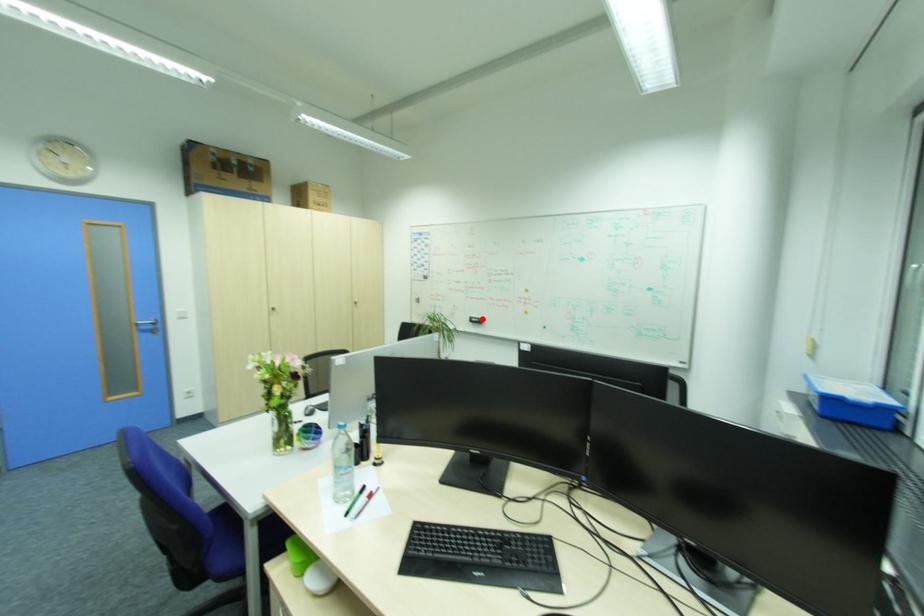
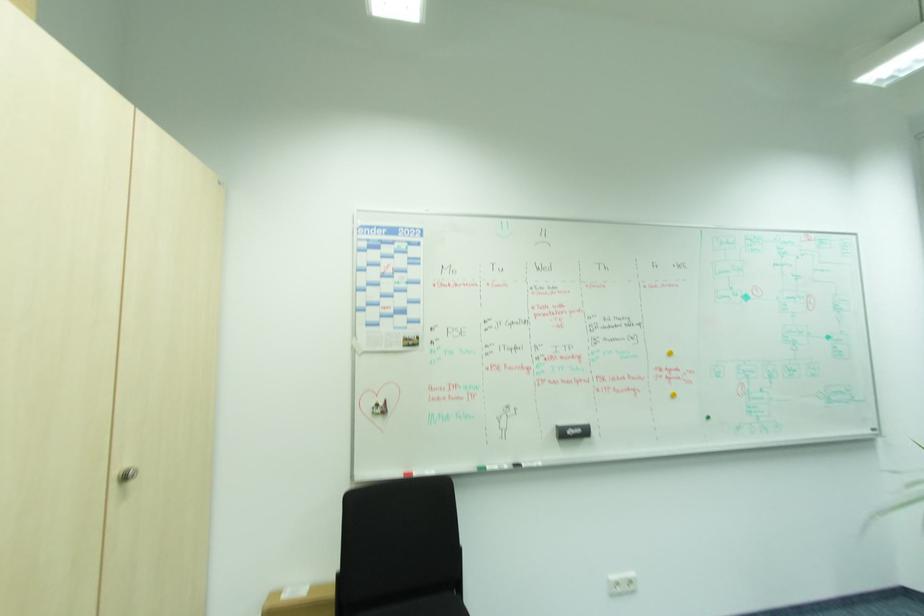
Find the pixel in the second image that matches the highlighted location in the first image.

(584, 430)